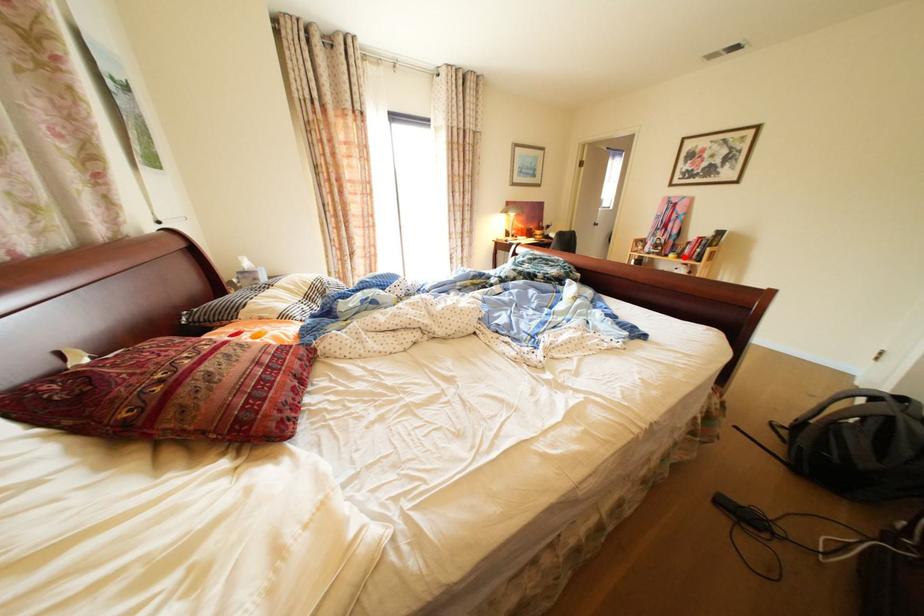
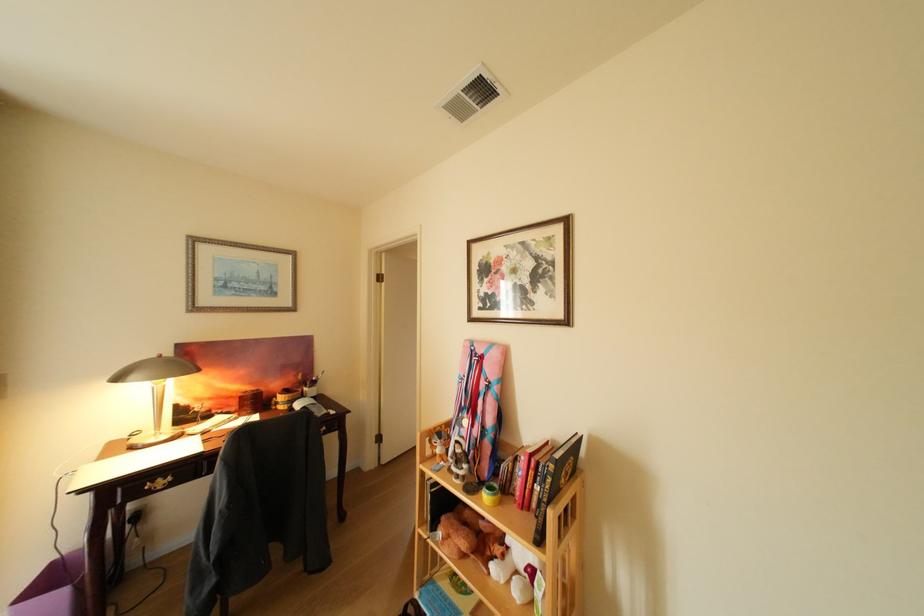
Find the pixel in the second image that matches the highlighted location in the first image.

(499, 499)